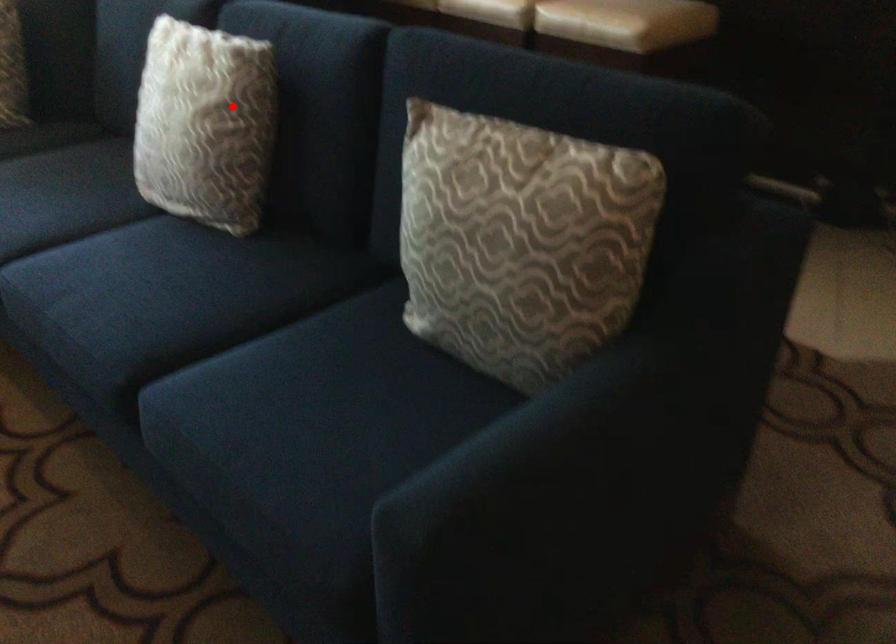
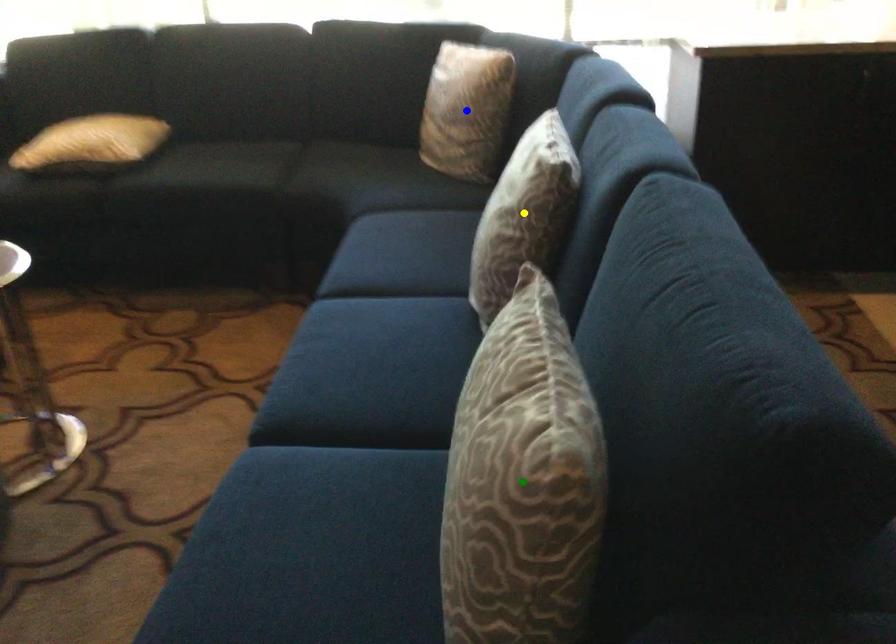
Question: I am providing you with two images of the same scene from different viewpoints. A red point is marked on the first image. You are given multiple points on the second image. Which point in image 2 is actually the same real-world point as the red point in image 1?

Choices:
 (A) green point
 (B) yellow point
 (C) blue point

Answer: (B)